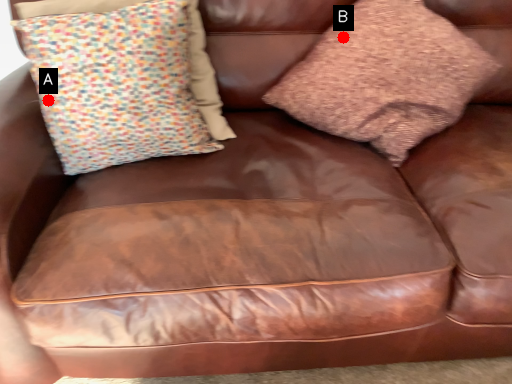
Question: Two points are circled on the image, labeled by A and B beside each circle. Which point appears farthest from the camera in this image?

Choices:
 (A) A is further
 (B) B is further

Answer: (B)